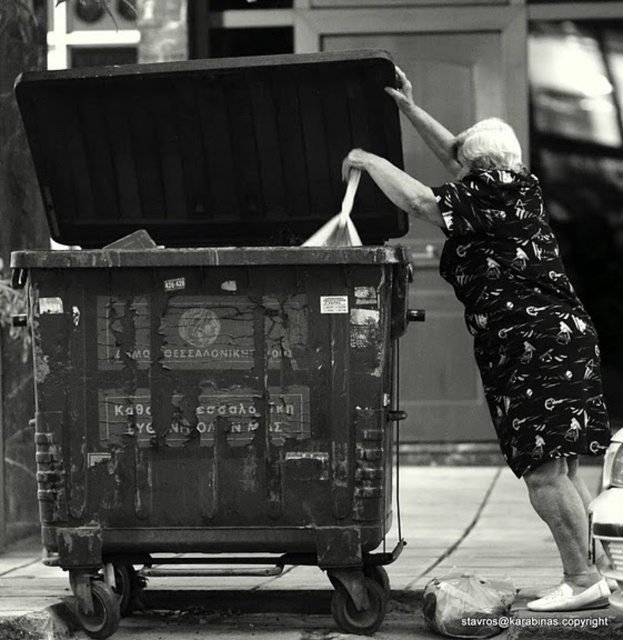
You are a photographer analyzing this black and white photo. You notice the printed fabric dress at upper right and the plastic bag at lower right. Which object is closer to the camera?

The printed fabric dress at upper right is closer to the camera because it is in front of the plastic bag at lower right.

You are a photographer analyzing the composition of this black and white photo. The image has a point at coordinates point (x=515, y=323). What object in the scene corresponds to this point?

The point (x=515, y=323) corresponds to the printed fabric dress at upper right.